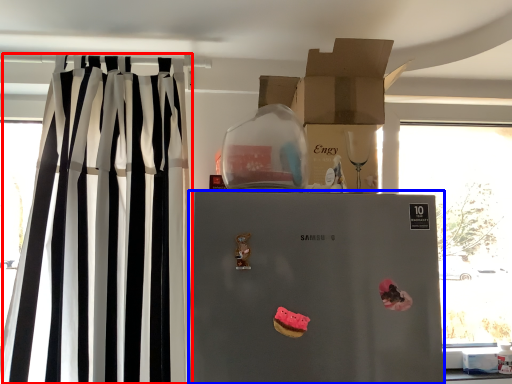
Question: Which of the following is the farthest to the observer, curtain (highlighted by a red box) or refrigerator (highlighted by a blue box)?

Choices:
 (A) curtain
 (B) refrigerator

Answer: (A)